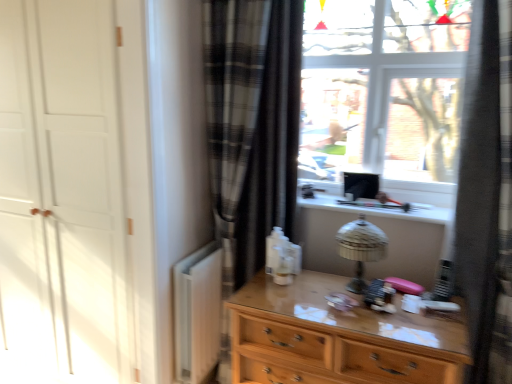
Question: Considering the relative positions of plaid fabric curtain at center and black plaid curtain at right in the image provided, is plaid fabric curtain at center to the left or to the right of black plaid curtain at right?

Choices:
 (A) left
 (B) right

Answer: (A)

Question: From a real-world perspective, is plaid fabric curtain at center physically located above or below black plaid curtain at right?

Choices:
 (A) above
 (B) below

Answer: (B)

Question: Which is farther from the plaid fabric curtain at center?

Choices:
 (A) white matte radiator at lower left
 (B) white matte door at left
 (C) metallic silver table lamp at center
 (D) wooden chest of drawers at center
 (E) black plaid curtain at right

Answer: (E)

Question: Based on their relative distances, which object is farther from the plaid fabric curtain at center?

Choices:
 (A) white matte door at left
 (B) white matte radiator at lower left
 (C) metallic silver table lamp at center
 (D) wooden chest of drawers at center
 (E) black plaid curtain at right

Answer: (E)